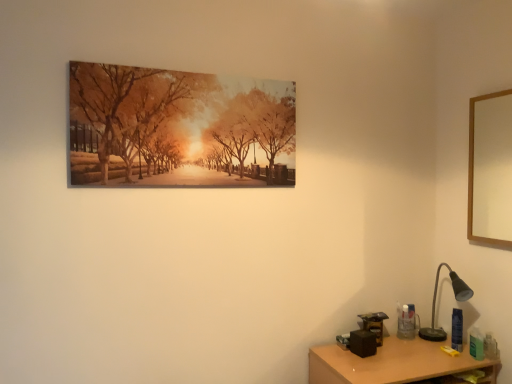
Question: Considering the relative positions of black metal table lamp at lower right and wooden desk at lower right in the image provided, is black metal table lamp at lower right to the right of wooden desk at lower right from the viewer's perspective?

Choices:
 (A) yes
 (B) no

Answer: (A)

Question: From a real-world perspective, is black metal table lamp at lower right over wooden desk at lower right?

Choices:
 (A) yes
 (B) no

Answer: (A)

Question: Would you say black metal table lamp at lower right is outside wooden desk at lower right?

Choices:
 (A) no
 (B) yes

Answer: (B)

Question: Does black metal table lamp at lower right come in front of wooden desk at lower right?

Choices:
 (A) yes
 (B) no

Answer: (B)

Question: From the image's perspective, is black metal table lamp at lower right beneath wooden desk at lower right?

Choices:
 (A) yes
 (B) no

Answer: (B)

Question: Choose the correct answer: Is black metal table lamp at lower right inside wooden desk at lower right or outside it?

Choices:
 (A) outside
 (B) inside

Answer: (A)

Question: Based on their sizes in the image, would you say black metal table lamp at lower right is bigger or smaller than wooden desk at lower right?

Choices:
 (A) big
 (B) small

Answer: (B)

Question: Considering the relative positions of black metal table lamp at lower right and wooden desk at lower right in the image provided, is black metal table lamp at lower right to the left or to the right of wooden desk at lower right?

Choices:
 (A) right
 (B) left

Answer: (A)

Question: Is black metal table lamp at lower right in front of or behind wooden desk at lower right in the image?

Choices:
 (A) behind
 (B) front

Answer: (A)

Question: From their relative heights in the image, would you say wooden picture frame at upper right, the first picture frame viewed from the right, is taller or shorter than black metal table lamp at lower right?

Choices:
 (A) tall
 (B) short

Answer: (A)

Question: From the image's perspective, is wooden picture frame at upper right, the second picture frame from the left, above or below black metal table lamp at lower right?

Choices:
 (A) below
 (B) above

Answer: (B)

Question: Is wooden picture frame at upper right, the second picture frame from the left, in front of or behind black metal table lamp at lower right in the image?

Choices:
 (A) behind
 (B) front

Answer: (B)

Question: Considering the positions of point (473, 183) and point (440, 332), is point (473, 183) closer or farther from the camera than point (440, 332)?

Choices:
 (A) closer
 (B) farther

Answer: (A)

Question: In terms of width, does wooden picture frame at upper right, the second picture frame from the left, look wider or thinner when compared to wooden desk at lower right?

Choices:
 (A) thin
 (B) wide

Answer: (A)

Question: Is wooden picture frame at upper right, the second picture frame from the left, taller or shorter than wooden desk at lower right?

Choices:
 (A) tall
 (B) short

Answer: (A)